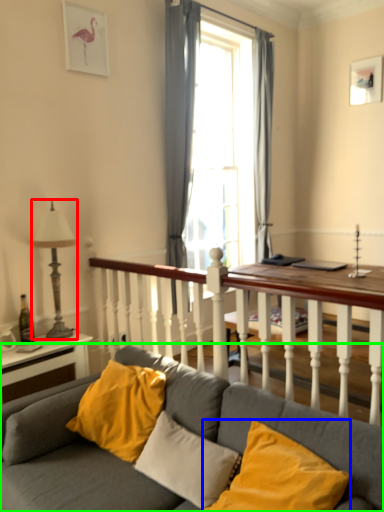
Question: Which is farther away from lamp (highlighted by a red box)? pillow (highlighted by a blue box) or studio couch (highlighted by a green box)?

Choices:
 (A) pillow
 (B) studio couch

Answer: (A)